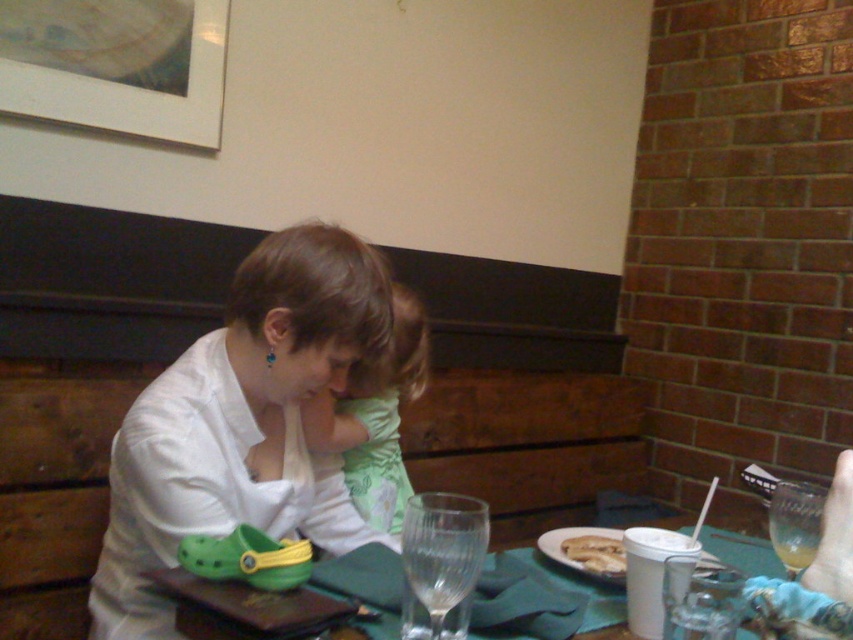
In the scene shown: Measure the distance between white matte shirt at center and camera.

white matte shirt at center is 37.25 inches from camera.

Who is positioned more to the right, white matte shirt at center or golden crispy bread at lower center?

From the viewer's perspective, golden crispy bread at lower center appears more on the right side.

Who is more distant from viewer, (x=260, y=312) or (x=579, y=538)?

Point (x=579, y=538)

Identify the location of white matte shirt at center. (242, 422).

Is white matte shirt at center thinner than green fabric shirt at center?

No, white matte shirt at center is not thinner than green fabric shirt at center.

Who is more distant from viewer, (x=343, y=330) or (x=369, y=504)?

The point (x=369, y=504) is behind.

Describe the element at coordinates (242, 422) in the screenshot. I see `white matte shirt at center` at that location.

The image size is (853, 640). I want to click on white matte shirt at center, so click(x=242, y=422).

Can you confirm if green fabric shirt at center is bigger than green rubber clog at lower left?

Indeed, green fabric shirt at center has a larger size compared to green rubber clog at lower left.

Who is positioned more to the left, green fabric shirt at center or green rubber clog at lower left?

green fabric shirt at center is more to the left.

Which is behind, point (364, 416) or point (677, 524)?

The point (677, 524) is behind.

This screenshot has width=853, height=640. Find the location of `green fabric shirt at center`. green fabric shirt at center is located at coordinates (374, 419).